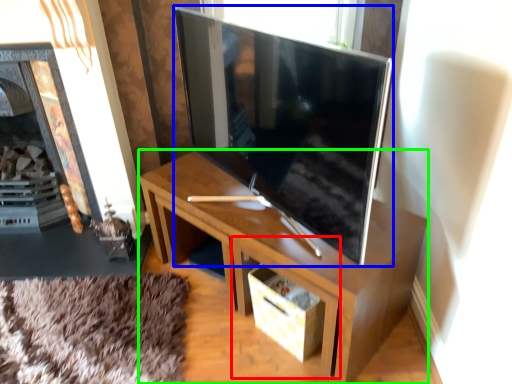
Question: Which object is the farthest from drawer (highlighted by a red box)? Choose among these: television (highlighted by a blue box) or desk (highlighted by a green box).

Choices:
 (A) television
 (B) desk

Answer: (A)